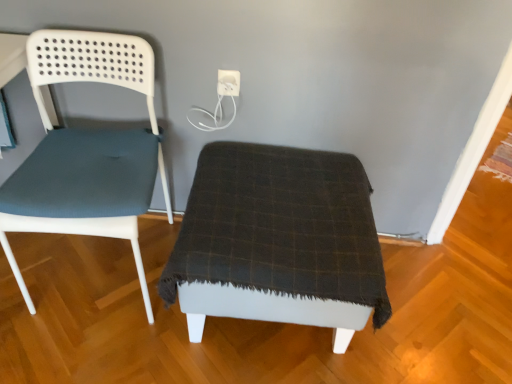
In order to click on free space that is in between matte blue fabric chair at left and dark plaid fabric ottoman at center in this screenshot , I will do `click(121, 338)`.